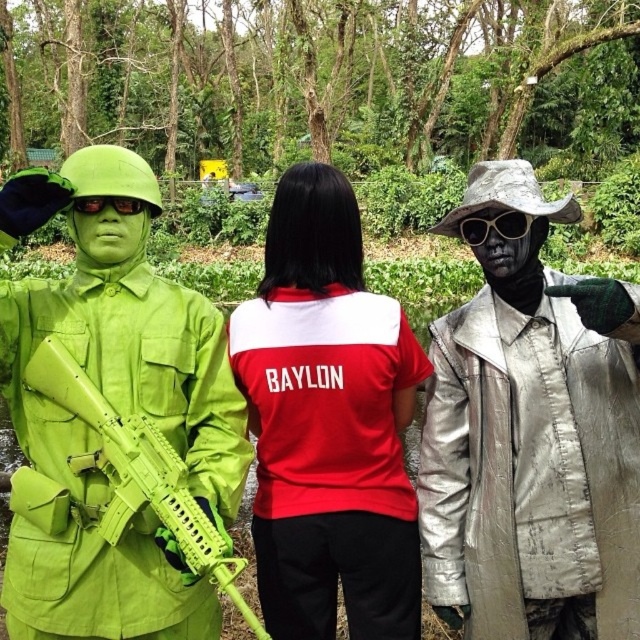
Is the position of metallic silver jacket at right more distant than that of lime green fabric uniform at left?

That is False.

Who is more forward, (538,273) or (1,371)?

Point (1,371) is more forward.

Is point (556, 547) in front of point (205, 362)?

Yes, it is in front of point (205, 362).

Find the location of a particular element. This screenshot has height=640, width=640. metallic silver jacket at right is located at coordinates (531, 433).

Does metallic silver jacket at right have a greater width compared to red matte shirt at center?

No.

Is metallic silver jacket at right above red matte shirt at center?

Yes, metallic silver jacket at right is above red matte shirt at center.

What do you see at coordinates (531, 433) in the screenshot?
I see `metallic silver jacket at right` at bounding box center [531, 433].

Identify the location of metallic silver jacket at right. (531, 433).

Does lime green fabric uniform at left appear on the right side of red matte shirt at center?

No, lime green fabric uniform at left is not to the right of red matte shirt at center.

What do you see at coordinates (113, 406) in the screenshot?
I see `lime green fabric uniform at left` at bounding box center [113, 406].

Find the location of a particular element. The height and width of the screenshot is (640, 640). lime green fabric uniform at left is located at coordinates 113,406.